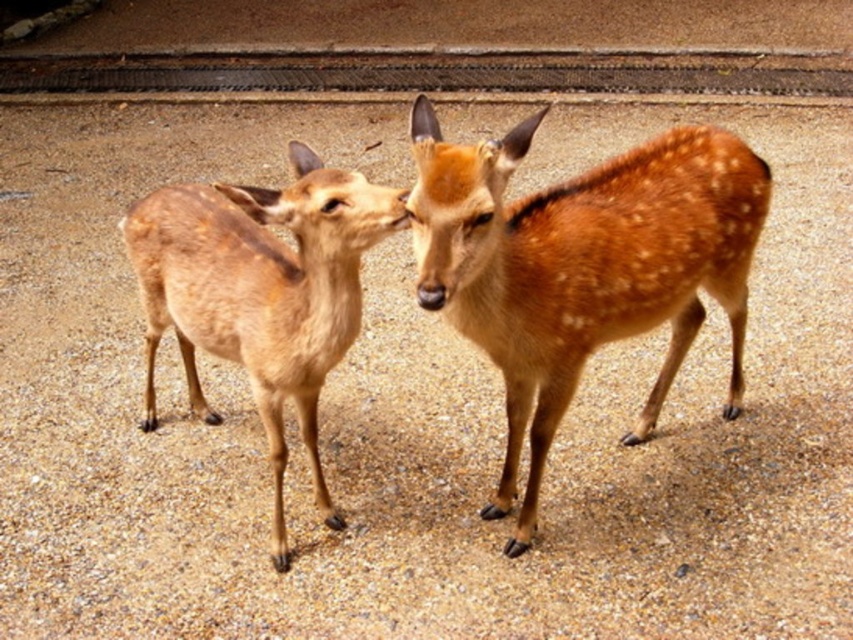
Does sandy brown fur at center appear under brown speckled fur at center?

No.

Between sandy brown fur at center and brown speckled fur at center, which one appears on the right side from the viewer's perspective?

From the viewer's perspective, sandy brown fur at center appears more on the right side.

Which is behind, point (558, 195) or point (312, 401)?

The point (312, 401) is behind.

You are a GUI agent. You are given a task and a screenshot of the screen. Output one action in this format:
    pyautogui.click(x=<x>, y=<y>)
    Task: Click on the sandy brown fur at center
    The height and width of the screenshot is (640, 853).
    Given the screenshot: What is the action you would take?
    pyautogui.click(x=581, y=266)